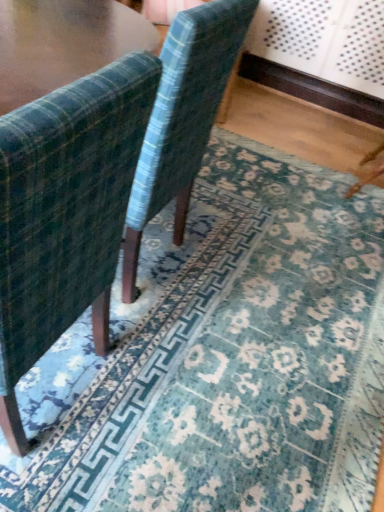
This screenshot has height=512, width=384. What do you see at coordinates (65, 213) in the screenshot?
I see `velvet green chair at left, the first chair viewed from the front` at bounding box center [65, 213].

Image resolution: width=384 pixels, height=512 pixels. Identify the location of velvet green chair at left, the first chair viewed from the front. (65, 213).

What do you see at coordinates (182, 118) in the screenshot? I see `velvet-like green chair at center, which is the 1th chair from back to front` at bounding box center [182, 118].

Where is `velvet-like green chair at center, which is the 1th chair from back to front`? The height and width of the screenshot is (512, 384). velvet-like green chair at center, which is the 1th chair from back to front is located at coordinates (182, 118).

Where is `velvet green chair at left, which is counted as the 2th chair, starting from the back`? This screenshot has height=512, width=384. velvet green chair at left, which is counted as the 2th chair, starting from the back is located at coordinates (65, 213).

Considering the relative positions of velvet-like green chair at center, which is the 1th chair from back to front, and velvet green chair at left, which is counted as the 2th chair, starting from the back, in the image provided, is velvet-like green chair at center, which is the 1th chair from back to front, to the left of velvet green chair at left, which is counted as the 2th chair, starting from the back, from the viewer's perspective?

In fact, velvet-like green chair at center, which is the 1th chair from back to front, is to the right of velvet green chair at left, which is counted as the 2th chair, starting from the back.

Who is more distant, velvet-like green chair at center, which is the 1th chair from back to front, or velvet green chair at left, the first chair viewed from the front?

velvet-like green chair at center, which is the 1th chair from back to front, is more distant.

Considering the points (238, 49) and (113, 75), which point is in front, point (238, 49) or point (113, 75)?

The point (113, 75) is in front.

From the image's perspective, would you say velvet-like green chair at center, positioned as the 2th chair in front-to-back order, is shown under velvet green chair at left, the first chair viewed from the front?

No, from the image's perspective, velvet-like green chair at center, positioned as the 2th chair in front-to-back order, is not below velvet green chair at left, the first chair viewed from the front.

From a real-world perspective, is velvet-like green chair at center, positioned as the 2th chair in front-to-back order, positioned under velvet green chair at left, the first chair viewed from the front, based on gravity?

Correct, in the physical world, velvet-like green chair at center, positioned as the 2th chair in front-to-back order, is lower than velvet green chair at left, the first chair viewed from the front.

Is velvet-like green chair at center, which is the 1th chair from back to front, thinner than velvet green chair at left, which is counted as the 2th chair, starting from the back?

Yes, velvet-like green chair at center, which is the 1th chair from back to front, is thinner than velvet green chair at left, which is counted as the 2th chair, starting from the back.

Is velvet-like green chair at center, positioned as the 2th chair in front-to-back order, taller or shorter than velvet green chair at left, the first chair viewed from the front?

Clearly, velvet-like green chair at center, positioned as the 2th chair in front-to-back order, is shorter compared to velvet green chair at left, the first chair viewed from the front.

Who is smaller, velvet-like green chair at center, which is the 1th chair from back to front, or velvet green chair at left, which is counted as the 2th chair, starting from the back?

With smaller size is velvet green chair at left, which is counted as the 2th chair, starting from the back.

Choose the correct answer: Is velvet-like green chair at center, positioned as the 2th chair in front-to-back order, inside velvet green chair at left, the first chair viewed from the front, or outside it?

The correct answer is: outside.

Is velvet-like green chair at center, which is the 1th chair from back to front, in contact with velvet green chair at left, the first chair viewed from the front?

No, velvet-like green chair at center, which is the 1th chair from back to front, is not in contact with velvet green chair at left, the first chair viewed from the front.

Could you tell me if velvet-like green chair at center, positioned as the 2th chair in front-to-back order, is turned towards velvet green chair at left, the first chair viewed from the front?

No.

Based on the photo, how different are the orientations of velvet-like green chair at center, positioned as the 2th chair in front-to-back order, and velvet green chair at left, which is counted as the 2th chair, starting from the back, in degrees?

They differ by 1.4 degrees in their facing directions.

Measure the distance between velvet-like green chair at center, positioned as the 2th chair in front-to-back order, and velvet green chair at left, which is counted as the 2th chair, starting from the back.

velvet-like green chair at center, positioned as the 2th chair in front-to-back order, and velvet green chair at left, which is counted as the 2th chair, starting from the back, are 12.68 inches apart.

Identify the location of chair in front of the velvet-like green chair at center, which is the 1th chair from back to front. The image size is (384, 512). (65, 213).

Which object is positioned more to the right, velvet green chair at left, which is counted as the 2th chair, starting from the back, or velvet-like green chair at center, which is the 1th chair from back to front?

Positioned to the right is velvet-like green chair at center, which is the 1th chair from back to front.

Which object is closer to the camera taking this photo, velvet green chair at left, which is counted as the 2th chair, starting from the back, or velvet-like green chair at center, which is the 1th chair from back to front?

velvet green chair at left, which is counted as the 2th chair, starting from the back.

Is point (70, 84) closer or farther from the camera than point (240, 7)?

Point (70, 84) is positioned closer to the camera compared to point (240, 7).

From the image's perspective, is velvet green chair at left, which is counted as the 2th chair, starting from the back, positioned above or below velvet-like green chair at center, positioned as the 2th chair in front-to-back order?

From the image's perspective, velvet green chair at left, which is counted as the 2th chair, starting from the back, appears below velvet-like green chair at center, positioned as the 2th chair in front-to-back order.

In the scene shown: From a real-world perspective, relative to velvet-like green chair at center, which is the 1th chair from back to front, is velvet green chair at left, which is counted as the 2th chair, starting from the back, vertically above or below?

Clearly, from a real-world perspective, velvet green chair at left, which is counted as the 2th chair, starting from the back, is above velvet-like green chair at center, which is the 1th chair from back to front.

Between velvet green chair at left, which is counted as the 2th chair, starting from the back, and velvet-like green chair at center, positioned as the 2th chair in front-to-back order, which one has smaller width?

velvet-like green chair at center, positioned as the 2th chair in front-to-back order.

Between velvet green chair at left, the first chair viewed from the front, and velvet-like green chair at center, positioned as the 2th chair in front-to-back order, which one has less height?

velvet-like green chair at center, positioned as the 2th chair in front-to-back order, is shorter.

Does velvet green chair at left, which is counted as the 2th chair, starting from the back, have a larger size compared to velvet-like green chair at center, positioned as the 2th chair in front-to-back order?

No, velvet green chair at left, which is counted as the 2th chair, starting from the back, is not bigger than velvet-like green chair at center, positioned as the 2th chair in front-to-back order.

Based on the photo, would you say velvet-like green chair at center, positioned as the 2th chair in front-to-back order, is part of velvet green chair at left, the first chair viewed from the front,'s contents?

No, velvet-like green chair at center, positioned as the 2th chair in front-to-back order, is not inside velvet green chair at left, the first chair viewed from the front.

Would you say velvet green chair at left, the first chair viewed from the front, is a long distance from velvet-like green chair at center, positioned as the 2th chair in front-to-back order?

No, velvet green chair at left, the first chair viewed from the front, is not far from velvet-like green chair at center, positioned as the 2th chair in front-to-back order.

Is velvet green chair at left, which is counted as the 2th chair, starting from the back, oriented towards velvet-like green chair at center, which is the 1th chair from back to front?

No, velvet green chair at left, which is counted as the 2th chair, starting from the back, is not aimed at velvet-like green chair at center, which is the 1th chair from back to front.

Identify the location of chair positioned vertically above the velvet-like green chair at center, positioned as the 2th chair in front-to-back order (from a real-world perspective). (65, 213).

The height and width of the screenshot is (512, 384). In the image, there is a velvet-like green chair at center, positioned as the 2th chair in front-to-back order. What are the coordinates of `chair below it (from the image's perspective)` in the screenshot? It's located at (65, 213).

This screenshot has height=512, width=384. What are the coordinates of `chair in front of the velvet-like green chair at center, which is the 1th chair from back to front` in the screenshot? It's located at (65, 213).